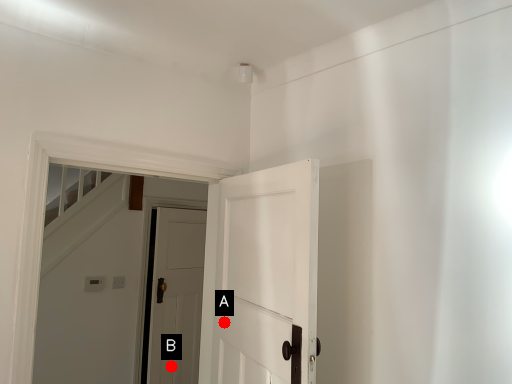
Question: Two points are circled on the image, labeled by A and B beside each circle. Which point is closer to the camera?

Choices:
 (A) A is closer
 (B) B is closer

Answer: (A)